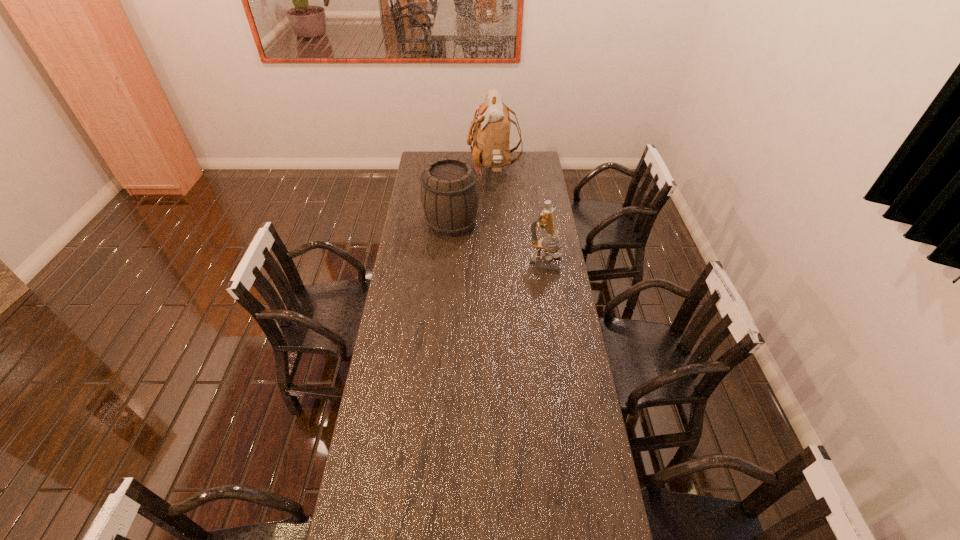
Find the location of a particular element. The height and width of the screenshot is (540, 960). the tallest object is located at coordinates (491, 133).

At what (x,y) coordinates should I click in order to perform the action: click on backpack. Please return your answer as a coordinate pair (x, y). This screenshot has height=540, width=960. Looking at the image, I should click on (491, 133).

Locate an element on the screen. microscope is located at coordinates (546, 220).

I want to click on the second nearest object, so click(450, 196).

Find the location of a particular element. free space located on the front-facing side of the backpack is located at coordinates (449, 170).

Image resolution: width=960 pixels, height=540 pixels. In order to click on free region located on the front-facing side of the backpack in this screenshot , I will do `click(443, 170)`.

What are the coordinates of `blank space located 0.200m on the front-facing side of the backpack` in the screenshot? It's located at (432, 170).

You are a GUI agent. You are given a task and a screenshot of the screen. Output one action in this format:
    pyautogui.click(x=<x>, y=<y>)
    Task: Click on the free spot located 0.270m on the back of the nearest object
    The height and width of the screenshot is (540, 960).
    Given the screenshot: What is the action you would take?
    pyautogui.click(x=539, y=219)

This screenshot has height=540, width=960. Find the location of `vacant space located on the front of the wine bucket`. vacant space located on the front of the wine bucket is located at coordinates (448, 261).

The height and width of the screenshot is (540, 960). Find the location of `object present at the far edge`. object present at the far edge is located at coordinates (491, 133).